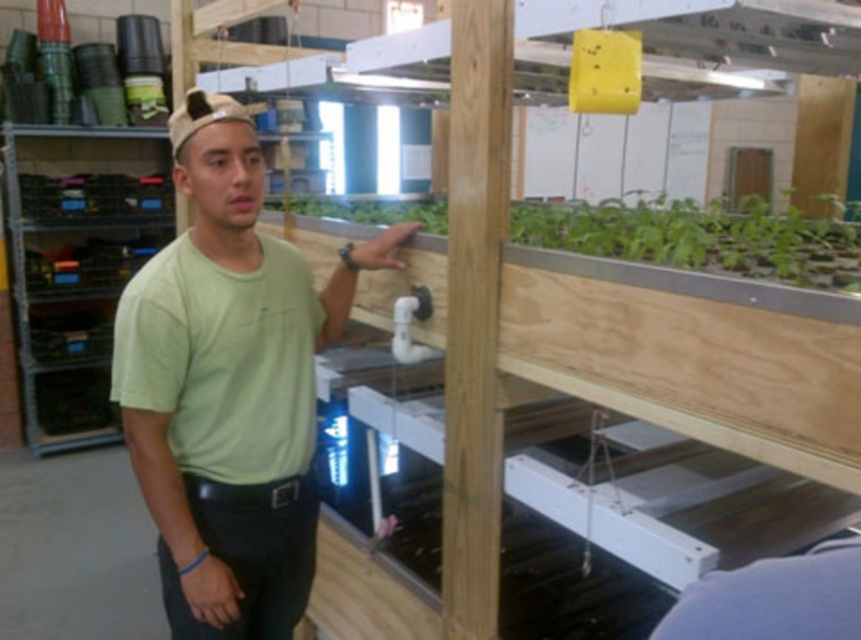
Question: Can you confirm if light green t-shirt at center is bigger than green matte plant at center?

Choices:
 (A) yes
 (B) no

Answer: (B)

Question: Does light green t-shirt at center appear on the left side of green matte plant at center?

Choices:
 (A) no
 (B) yes

Answer: (B)

Question: Among these objects, which one is farthest from the camera?

Choices:
 (A) light green t-shirt at center
 (B) green matte plant at center

Answer: (A)

Question: Is light green t-shirt at center wider than green matte plant at center?

Choices:
 (A) no
 (B) yes

Answer: (A)

Question: Which object appears closest to the camera in this image?

Choices:
 (A) light green t-shirt at center
 (B) green matte plant at center

Answer: (B)